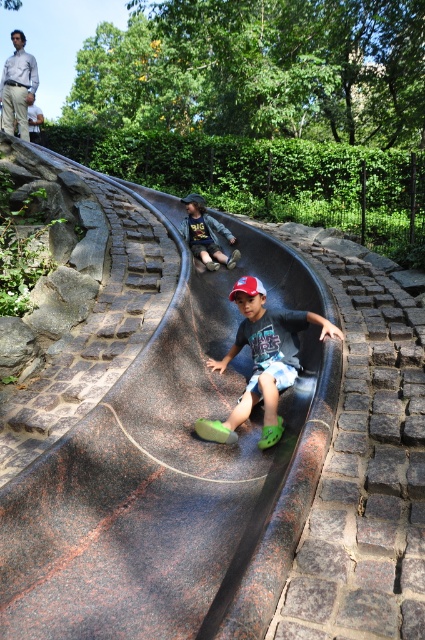
Question: Among these objects, which one is farthest from the camera?

Choices:
 (A) white shirt at upper left
 (B) green rubber shoes at center

Answer: (A)

Question: Is green rubber shoes at center further to camera compared to dark blue denim jacket at center?

Choices:
 (A) yes
 (B) no

Answer: (B)

Question: From the image, what is the correct spatial relationship of rubberized smooth slide at center in relation to green rubber shoes at center?

Choices:
 (A) left
 (B) right

Answer: (A)

Question: Is rubberized smooth slide at center smaller than dark blue denim jacket at center?

Choices:
 (A) no
 (B) yes

Answer: (A)

Question: Which point is farther from the camera taking this photo?

Choices:
 (A) (204, 260)
 (B) (6, 109)
 (C) (172, 595)
 (D) (295, 321)

Answer: (B)

Question: Estimate the real-world distances between objects in this image. Which object is farther from the white shirt at upper left?

Choices:
 (A) green rubber shoes at center
 (B) rubberized smooth slide at center

Answer: (A)